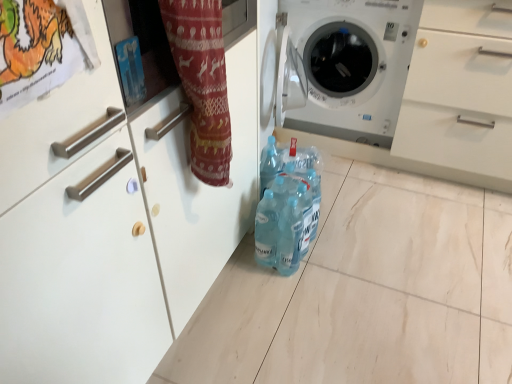
Describe the element at coordinates (352, 65) in the screenshot. I see `white plastic washing machine at center` at that location.

The image size is (512, 384). What are the coordinates of `white plastic washing machine at center` in the screenshot? It's located at pos(352,65).

From a real-world perspective, is white plastic washing machine at center above or below brushed metal drawer at upper left?

white plastic washing machine at center is situated lower than brushed metal drawer at upper left in the real world.

Considering the sizes of objects white plastic washing machine at center and brushed metal drawer at upper left in the image provided, who is thinner, white plastic washing machine at center or brushed metal drawer at upper left?

Thinner between the two is brushed metal drawer at upper left.

Are white plastic washing machine at center and brushed metal drawer at upper left located far from each other?

Indeed, white plastic washing machine at center is not near brushed metal drawer at upper left.

Identify the location of washing machine above the brushed metal drawer at upper left (from the image's perspective). (352, 65).

Who is shorter, translucent plastic bottles at center or matte red fabric at center?

translucent plastic bottles at center is shorter.

Is matte red fabric at center inside translucent plastic bottles at center?

No, matte red fabric at center is not surrounded by translucent plastic bottles at center.

From a real-world perspective, who is located lower, translucent plastic bottles at center or matte red fabric at center?

From a 3D spatial view, translucent plastic bottles at center is below.

Consider the image. From the image's perspective, is translucent plastic bottles at center positioned above or below matte red fabric at center?

Clearly, from the image's perspective, translucent plastic bottles at center is below matte red fabric at center.

In the image, is white plastic washing machine at center on the left side or the right side of matte red fabric at center?

white plastic washing machine at center is positioned on matte red fabric at center's right side.

You are a GUI agent. You are given a task and a screenshot of the screen. Output one action in this format:
    pyautogui.click(x=<x>, y=<y>)
    Task: Click on the washing machine that is under the matte red fabric at center (from a real-world perspective)
    
    Given the screenshot: What is the action you would take?
    pyautogui.click(x=352, y=65)

Would you say white plastic washing machine at center contains matte red fabric at center?

No, matte red fabric at center is not surrounded by white plastic washing machine at center.

From the image's perspective, relative to matte red fabric at center, is white plastic washing machine at center above or below?

From the image's perspective, white plastic washing machine at center appears above matte red fabric at center.

Is the depth of brushed metal drawer at upper left greater than that of translucent plastic bottles at center?

No, brushed metal drawer at upper left is in front of translucent plastic bottles at center.

In terms of height, does brushed metal drawer at upper left look taller or shorter compared to translucent plastic bottles at center?

Considering their sizes, brushed metal drawer at upper left has less height than translucent plastic bottles at center.

Is brushed metal drawer at upper left oriented away from translucent plastic bottles at center?

No, brushed metal drawer at upper left is not facing away from translucent plastic bottles at center.

Which object is positioned more to the left, brushed metal drawer at upper left or white plastic washing machine at center?

brushed metal drawer at upper left.

Does brushed metal drawer at upper left have a greater height compared to white plastic washing machine at center?

No, brushed metal drawer at upper left is not taller than white plastic washing machine at center.

From the image's perspective, is brushed metal drawer at upper left under white plastic washing machine at center?

Indeed, from the image's perspective, brushed metal drawer at upper left is shown beneath white plastic washing machine at center.

Does brushed metal drawer at upper left touch white plastic washing machine at center?

They are not placed beside each other.

Which of these two, matte red fabric at center or white plastic washing machine at center, is thinner?

Thinner between the two is matte red fabric at center.

Can you tell me how much matte red fabric at center and white plastic washing machine at center differ in facing direction?

matte red fabric at center and white plastic washing machine at center are facing 88.7 degrees away from each other.

Is matte red fabric at center looking in the opposite direction of white plastic washing machine at center?

matte red fabric at center does not have its back to white plastic washing machine at center.

Is matte red fabric at center next to white plastic washing machine at center?

No.

Can you see brushed metal drawer at upper left touching matte red fabric at center?

brushed metal drawer at upper left is not next to matte red fabric at center, and they're not touching.

Is matte red fabric at center completely or partially inside brushed metal drawer at upper left?

No, brushed metal drawer at upper left does not contain matte red fabric at center.

From the image's perspective, is brushed metal drawer at upper left on top of matte red fabric at center?

No, from the image's perspective, brushed metal drawer at upper left is not above matte red fabric at center.

Which object is positioned more to the right, brushed metal drawer at upper left or matte red fabric at center?

matte red fabric at center is more to the right.

Identify the location of drawer that is on the left side of white plastic washing machine at center. The height and width of the screenshot is (384, 512). (56, 119).

At what (x,y) coordinates should I click in order to perform the action: click on cabinetry that is in front of the translucent plastic bottles at center. Please return your answer as a coordinate pair (x, y). Image resolution: width=512 pixels, height=384 pixels. Looking at the image, I should click on (196, 177).

Looking at the image, which one is located further to brushed metal drawer at upper left, white plastic washing machine at center or translucent plastic bottles at center?

white plastic washing machine at center.

From the image, which object appears to be farther from translucent plastic bottles at center, brushed metal drawer at upper left or white plastic washing machine at center?

Among the two, brushed metal drawer at upper left is located further to translucent plastic bottles at center.

Looking at the image, which one is located closer to white plastic washing machine at center, translucent plastic bottles at center or matte red fabric at center?

translucent plastic bottles at center.

When comparing their distances from matte red fabric at center, does translucent plastic bottles at center or brushed metal drawer at upper left seem closer?

Among the two, translucent plastic bottles at center is located nearer to matte red fabric at center.

Which object lies nearer to the anchor point brushed metal drawer at upper left, translucent plastic bottles at center or matte red fabric at center?

matte red fabric at center is positioned closer to the anchor brushed metal drawer at upper left.

Based on their spatial positions, is translucent plastic bottles at center or white plastic washing machine at center further from brushed metal drawer at upper left?

white plastic washing machine at center is positioned further to the anchor brushed metal drawer at upper left.

Based on their spatial positions, is white plastic washing machine at center or translucent plastic bottles at center closer to matte red fabric at center?

translucent plastic bottles at center lies closer to matte red fabric at center than the other object.

When comparing their distances from translucent plastic bottles at center, does white plastic washing machine at center or matte red fabric at center seem closer?

Based on the image, matte red fabric at center appears to be nearer to translucent plastic bottles at center.

The height and width of the screenshot is (384, 512). I want to click on bottle between matte red fabric at center and white plastic washing machine at center in the front-back direction, so click(x=289, y=211).

Where is `bottle located between brushed metal drawer at upper left and white plastic washing machine at center in the depth direction`? This screenshot has height=384, width=512. bottle located between brushed metal drawer at upper left and white plastic washing machine at center in the depth direction is located at coordinates (289, 211).

The width and height of the screenshot is (512, 384). In order to click on cabinetry between brushed metal drawer at upper left and white plastic washing machine at center in the front-back direction in this screenshot , I will do `click(196, 177)`.

You are a GUI agent. You are given a task and a screenshot of the screen. Output one action in this format:
    pyautogui.click(x=<x>, y=<y>)
    Task: Click on the cabinetry located between brushed metal drawer at upper left and translucent plastic bottles at center in the depth direction
    Image resolution: width=512 pixels, height=384 pixels.
    Given the screenshot: What is the action you would take?
    pyautogui.click(x=196, y=177)